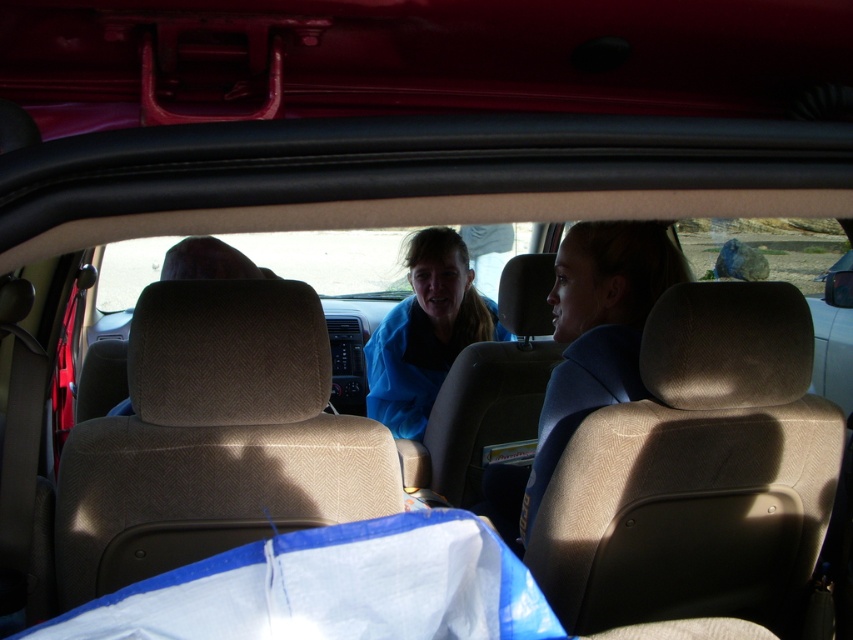
Question: Is blue fabric headrest at right behind blue fabric jacket at center?

Choices:
 (A) yes
 (B) no

Answer: (B)

Question: Considering the relative positions of blue fabric headrest at right and blue fabric jacket at center in the image provided, where is blue fabric headrest at right located with respect to blue fabric jacket at center?

Choices:
 (A) right
 (B) left

Answer: (A)

Question: Which object appears closest to the camera in this image?

Choices:
 (A) blue fabric headrest at right
 (B) blue fabric jacket at center

Answer: (A)

Question: Where is blue fabric headrest at right located in relation to blue fabric jacket at center in the image?

Choices:
 (A) above
 (B) below

Answer: (B)